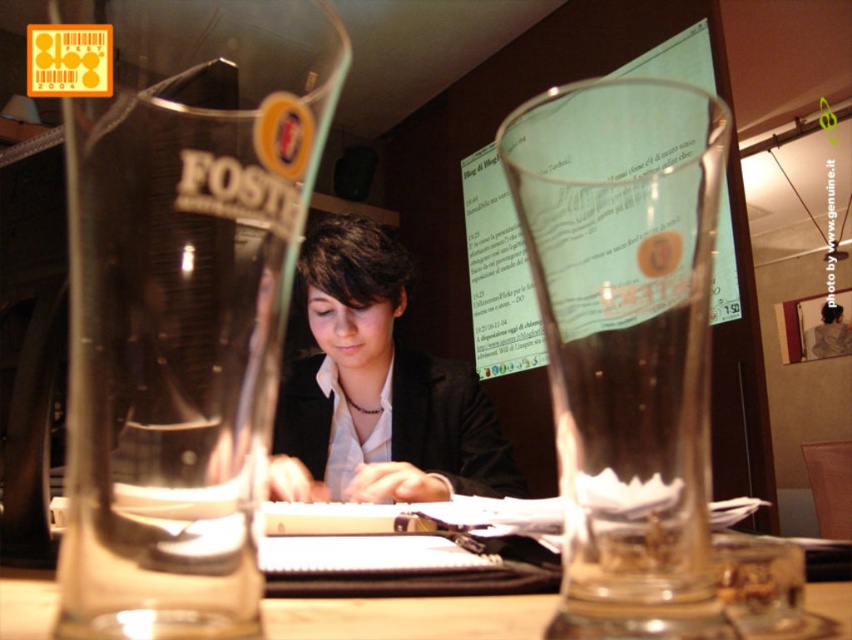
Between matte black jacket at center and transparent glass table at center, which one is positioned lower?

Positioned lower is transparent glass table at center.

Does matte black jacket at center have a smaller size compared to transparent glass table at center?

Actually, matte black jacket at center might be larger than transparent glass table at center.

You are a GUI agent. You are given a task and a screenshot of the screen. Output one action in this format:
    pyautogui.click(x=<x>, y=<y>)
    Task: Click on the matte black jacket at center
    The height and width of the screenshot is (640, 852).
    Given the screenshot: What is the action you would take?
    pyautogui.click(x=377, y=390)

Is transparent glass foster beer glass at left further to camera compared to transparent glass at center?

No, it is not.

Who is higher up, transparent glass foster beer glass at left or transparent glass at center?

Positioned higher is transparent glass at center.

Describe the element at coordinates (183, 300) in the screenshot. The height and width of the screenshot is (640, 852). I see `transparent glass foster beer glass at left` at that location.

Identify the location of transparent glass foster beer glass at left. The image size is (852, 640). (183, 300).

Can you confirm if transparent glass at center is shorter than matte black jacket at center?

Correct, transparent glass at center is not as tall as matte black jacket at center.

Find the location of a particular element. Image resolution: width=852 pixels, height=640 pixels. transparent glass at center is located at coordinates (626, 340).

In order to click on transparent glass at center in this screenshot , I will do `click(626, 340)`.